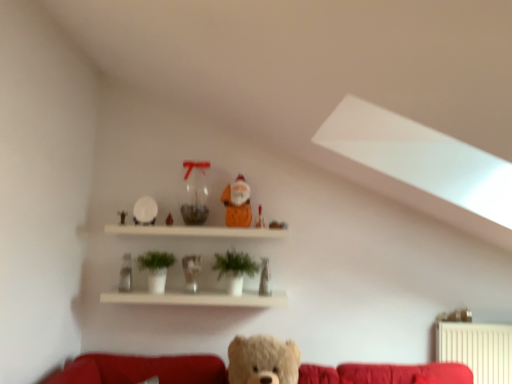
Where is `free location to the right of matte glass vase at upper center, the 4th toy when ordered from right to left`? The image size is (512, 384). free location to the right of matte glass vase at upper center, the 4th toy when ordered from right to left is located at coordinates (191, 223).